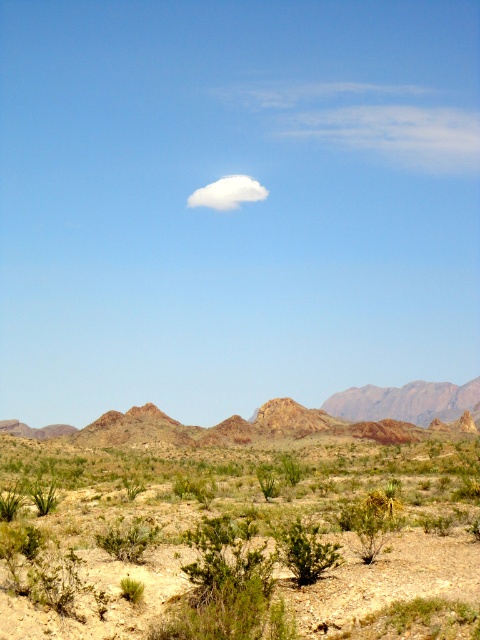
Can you confirm if green shrubs at center is positioned above white fluffy cloud at upper center?

No.

Between green shrubs at center and white fluffy cloud at upper center, which one appears on the left side from the viewer's perspective?

white fluffy cloud at upper center

Describe the element at coordinates (242, 540) in the screenshot. I see `green shrubs at center` at that location.

The image size is (480, 640). I want to click on green shrubs at center, so click(x=242, y=540).

Can you confirm if green shrubs at center is bigger than rustic rock formation at center?

Incorrect, green shrubs at center is not larger than rustic rock formation at center.

Does green shrubs at center have a smaller size compared to rustic rock formation at center?

Yes.

Who is more distant from viewer, (361, 492) or (249, 426)?

Point (249, 426)

This screenshot has width=480, height=640. I want to click on green shrubs at center, so click(242, 540).

Is rustic rock formation at center shorter than white fluffy cloud at upper center?

No.

Who is higher up, rustic rock formation at center or white fluffy cloud at upper center?

white fluffy cloud at upper center

Who is more forward, (455,385) or (252,182)?

Positioned in front is point (455,385).

Where is `rustic rock formation at center`? rustic rock formation at center is located at coordinates (278, 417).